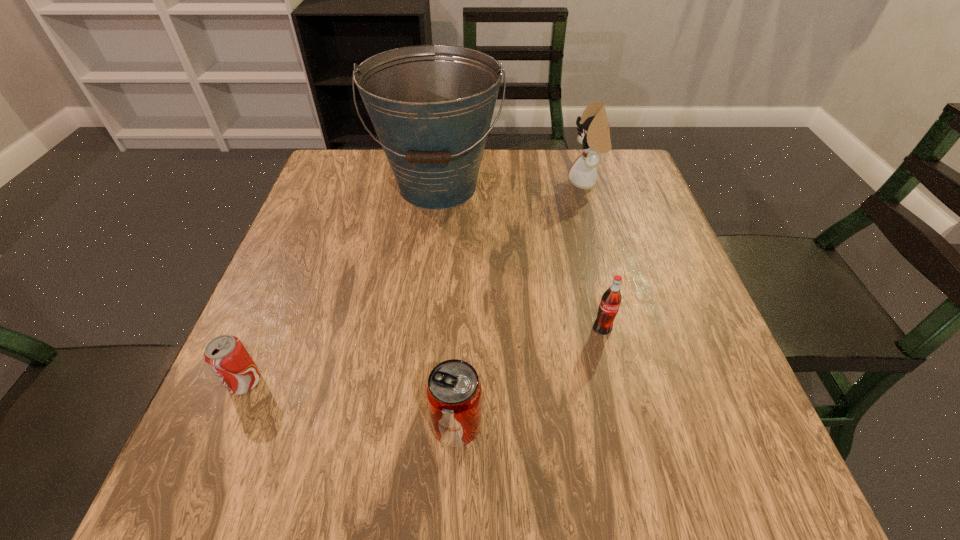
Image resolution: width=960 pixels, height=540 pixels. What are the coordinates of `object that is the closest to the rightmost soda can` in the screenshot? It's located at (454, 394).

Image resolution: width=960 pixels, height=540 pixels. In order to click on soda can that is the second closest one to the leftmost soda can in this screenshot , I will do `click(611, 298)`.

Locate which soda can is the closest to the second soda can from right to left. Please provide its 2D coordinates. Your answer should be formatted as a tuple, i.e. [(x, y)], where the tuple contains the x and y coordinates of a point satisfying the conditions above.

[(611, 298)]

Identify the location of free space that satisfies the following two spatial constraints: 1. with the handle on opposite sides of the second soda can from right to left; 2. on the left side of the tallest object. (412, 425).

At what (x,y) coordinates should I click in order to perform the action: click on vacant region that satisfies the following two spatial constraints: 1. with the handle on opposite sides of the second soda can from right to left; 2. on the right side of the bucket. Please return your answer as a coordinate pair (x, y). The width and height of the screenshot is (960, 540). Looking at the image, I should click on (412, 425).